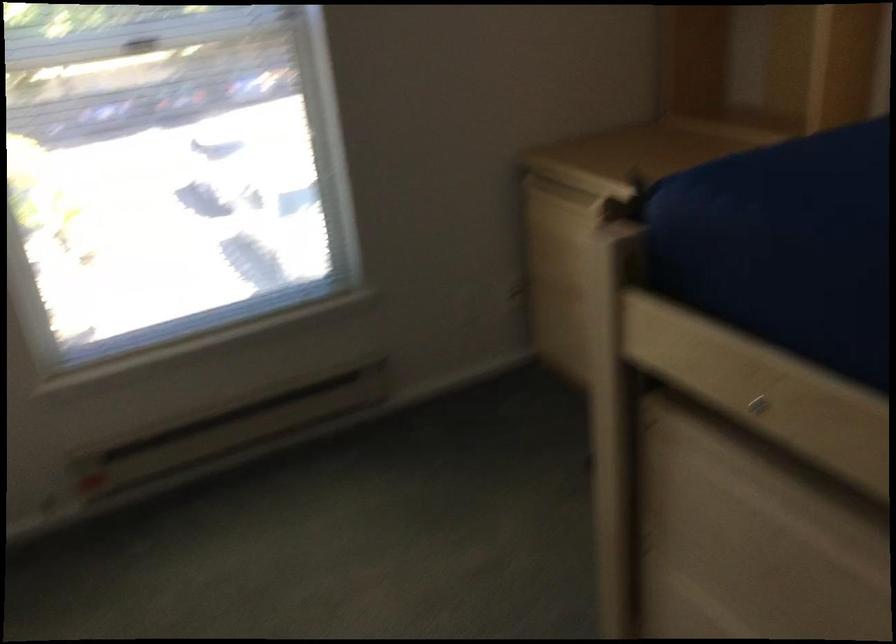
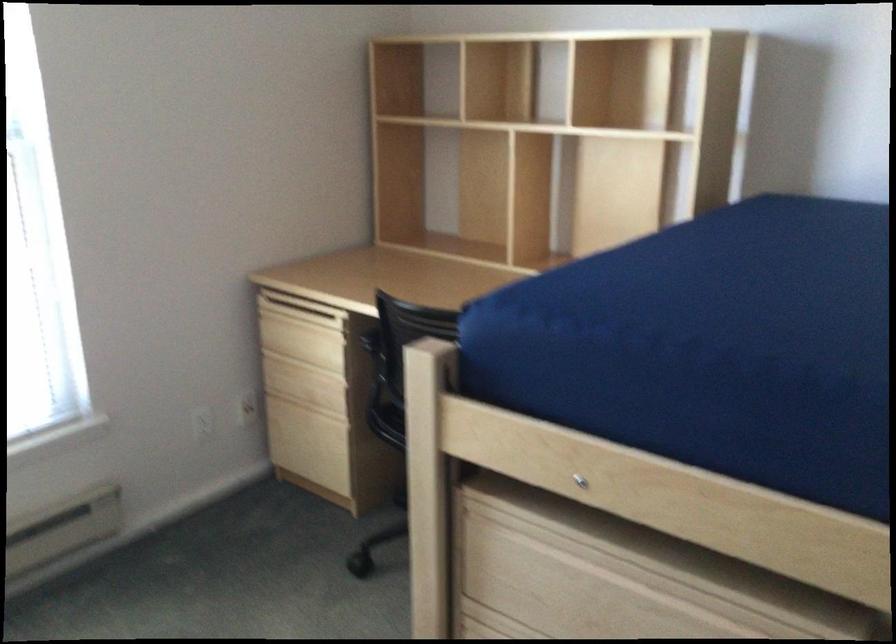
The point at (760,399) is marked in the first image. Where is the corresponding point in the second image?

(579, 480)